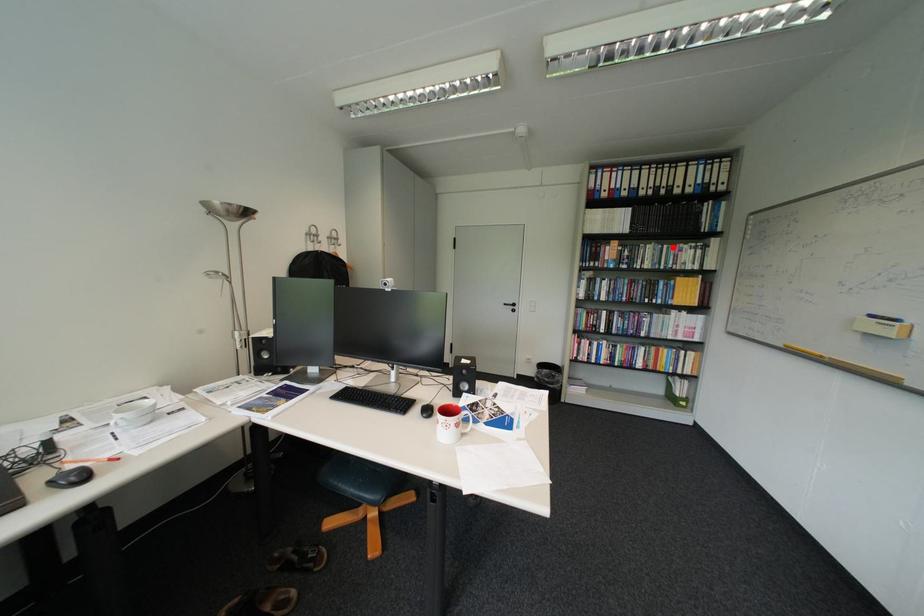
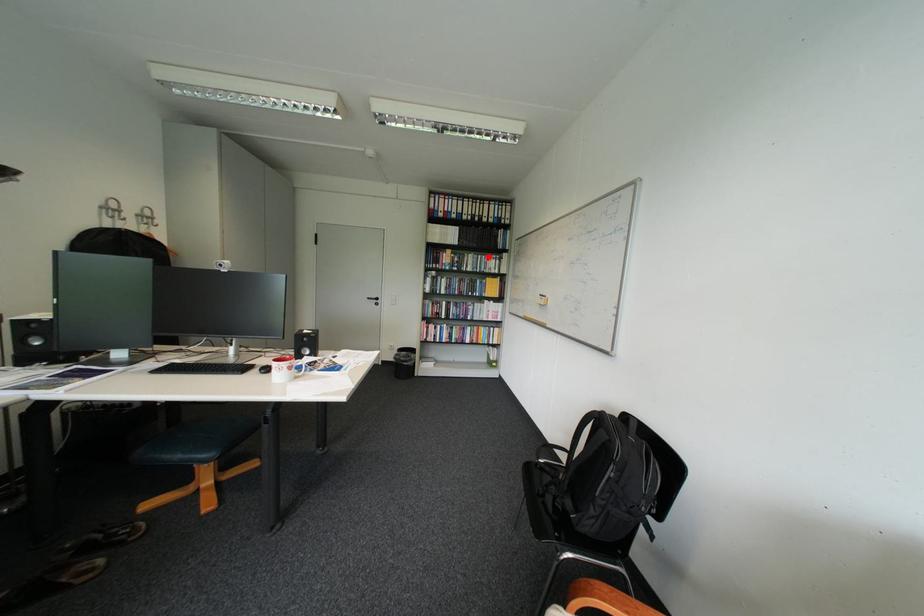
I am providing you with two images of the same scene from different viewpoints. A red point is marked on the first image and another point is marked on the second image. Does the point marked in image1 correspond to the same location as the one in image2?

Yes